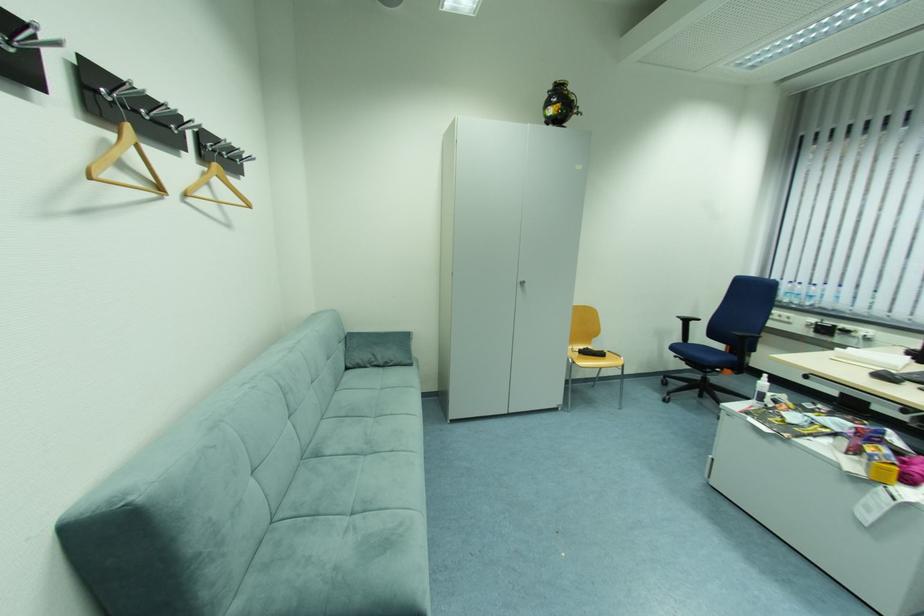
The height and width of the screenshot is (616, 924). I want to click on sofa sitting surface, so click(x=360, y=503).